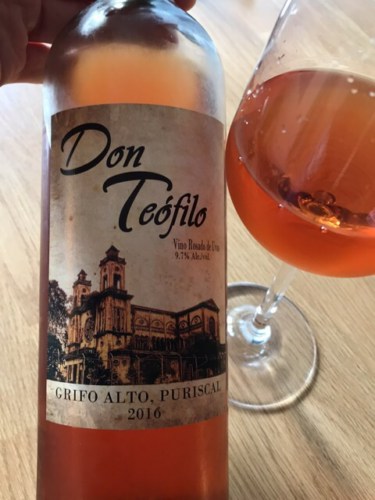
I want to click on bottle, so click(x=162, y=38).